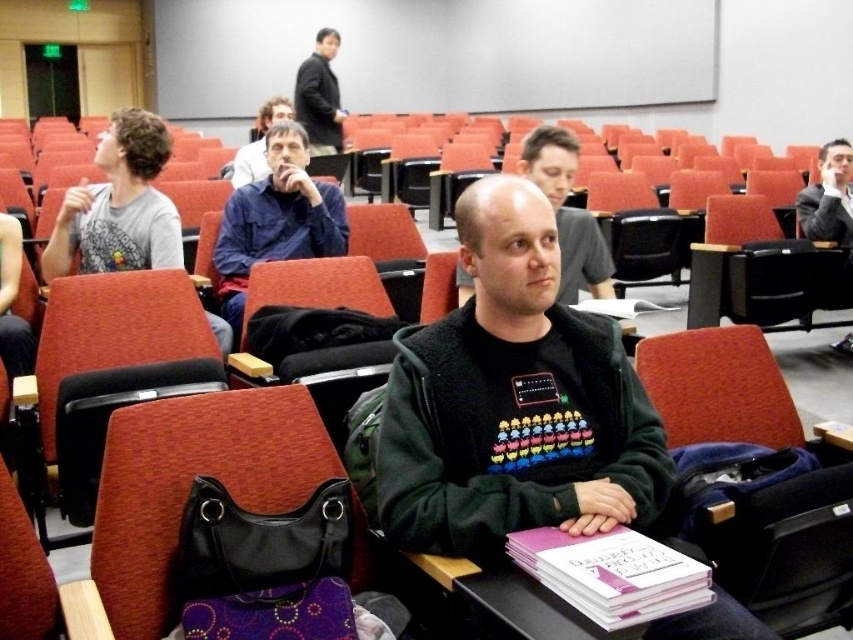
Who is taller, blue cotton shirt at center or dark gray jacket at upper center?

With more height is dark gray jacket at upper center.

Can you confirm if blue cotton shirt at center is bigger than dark gray jacket at upper center?

No.

Where is `blue cotton shirt at center`? The image size is (853, 640). blue cotton shirt at center is located at coordinates (276, 220).

Between point (611, 449) and point (653, 378), which one is positioned in front?

Positioned in front is point (611, 449).

Which of these two, black fleece jacket at center or textured fabric chair at center, stands shorter?

With less height is textured fabric chair at center.

Identify the location of black fleece jacket at center. (514, 401).

Where is `black fleece jacket at center`? The image size is (853, 640). black fleece jacket at center is located at coordinates (514, 401).

Is point (483, 324) farther from camera compared to point (318, 150)?

No, it is in front of (318, 150).

Where is `black fleece jacket at center`? This screenshot has width=853, height=640. black fleece jacket at center is located at coordinates (514, 401).